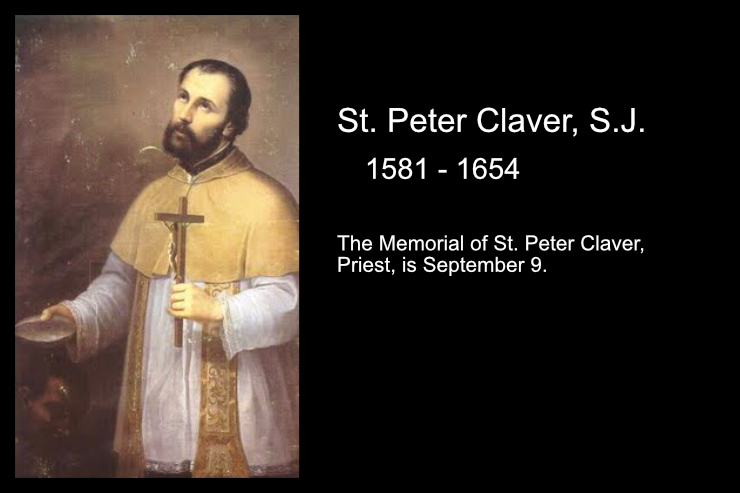
Identify the location of crucifix. (180, 218).